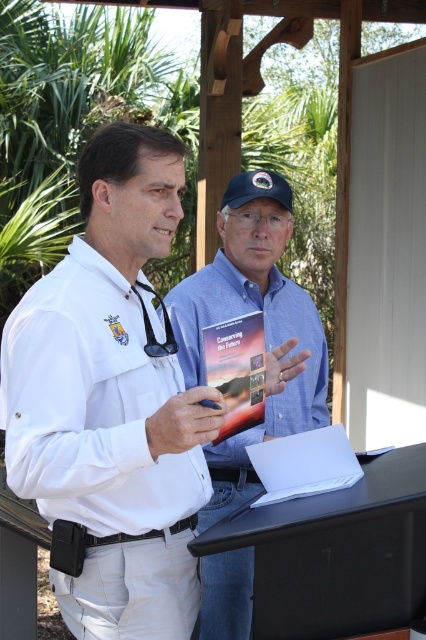
Question: Does white matte shirt at center appear on the left side of black rubber stethoscope at center?

Choices:
 (A) no
 (B) yes

Answer: (B)

Question: Which object is positioned farthest from the black rubber stethoscope at center?

Choices:
 (A) blue cotton shirt at center
 (B) white matte shirt at center

Answer: (A)

Question: Among these objects, which one is farthest from the camera?

Choices:
 (A) blue cotton shirt at center
 (B) white matte shirt at center
 (C) black rubber stethoscope at center

Answer: (A)

Question: Does blue cotton shirt at center come behind black rubber stethoscope at center?

Choices:
 (A) no
 (B) yes

Answer: (B)

Question: Which object is closer to the camera taking this photo?

Choices:
 (A) matte paper book at center
 (B) blue cotton shirt at center

Answer: (A)

Question: Is blue cotton shirt at center thinner than matte paper book at center?

Choices:
 (A) no
 (B) yes

Answer: (A)